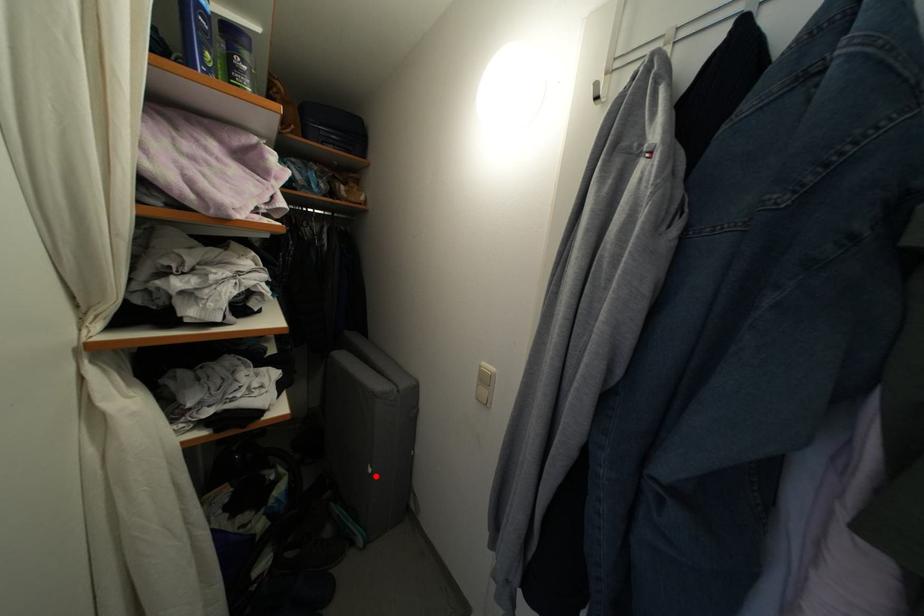
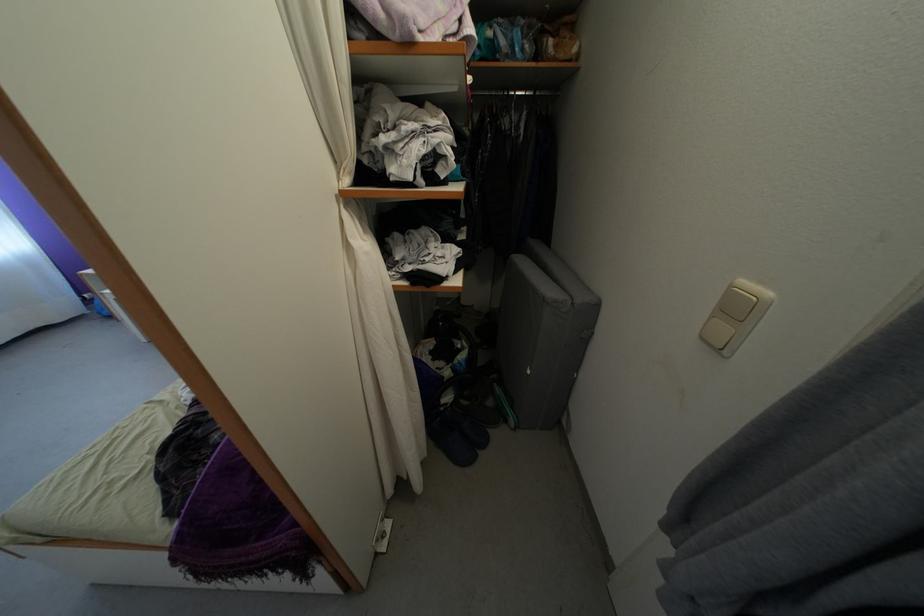
Find the pixel in the second image that matches the highlighted location in the first image.

(535, 378)